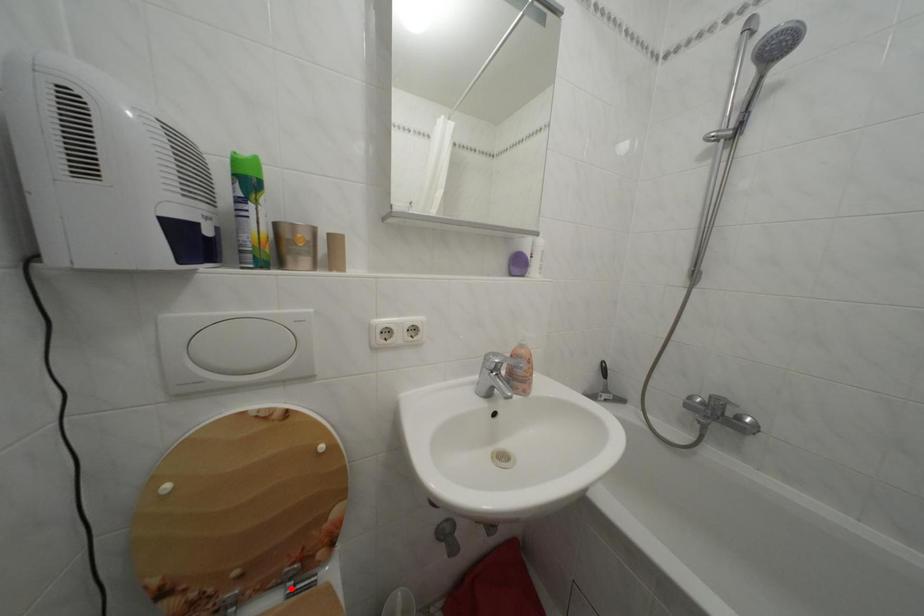
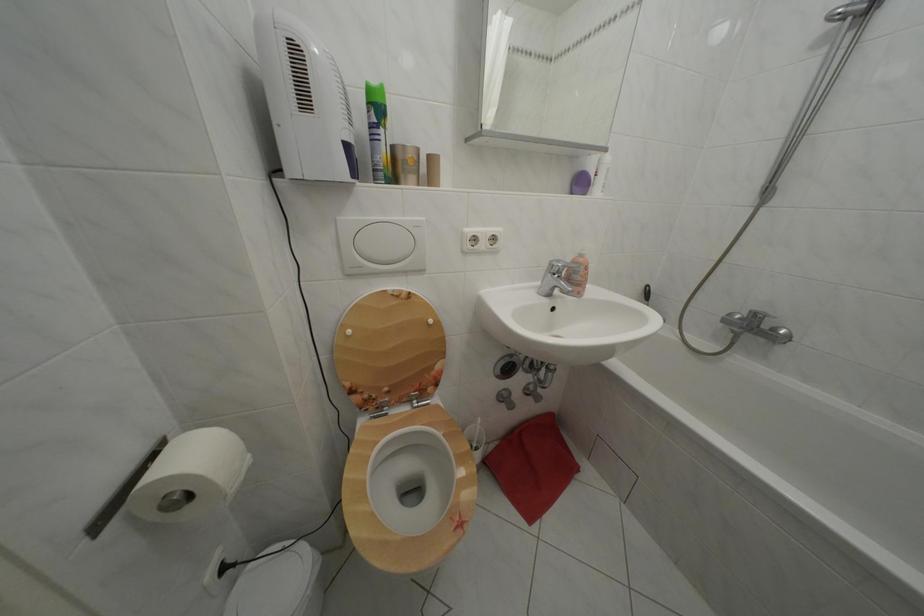
Question: A red point is marked in image1. In image2, is the corresponding 3D point closer to the camera or farther? Reply with the corresponding letter.

Choices:
 (A) The corresponding 3D point is closer.
 (B) The corresponding 3D point is farther.

Answer: (B)